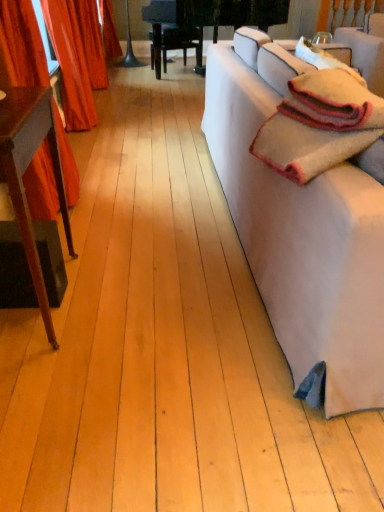
Find the location of a particular element. white fabric couch at right is located at coordinates (301, 233).

This screenshot has width=384, height=512. Identify the location of soft woolen blanket at right. (317, 125).

The image size is (384, 512). I want to click on velvet red curtain at left, marked as the 1th curtain in a front-to-back arrangement, so click(x=22, y=45).

The width and height of the screenshot is (384, 512). What do you see at coordinates (25, 170) in the screenshot? I see `mahogany wood table at left` at bounding box center [25, 170].

Find the location of `velvet red curtain at left, the first curtain when ordered from back to front`. velvet red curtain at left, the first curtain when ordered from back to front is located at coordinates (77, 57).

From a real-world perspective, is soft woolen blanket at right located beneath mahogany wood table at left?

No, from a real-world perspective, soft woolen blanket at right is not beneath mahogany wood table at left.

Is point (351, 122) positioned in front of point (23, 167)?

That is True.

Is soft woolen blanket at right positioned beyond the bounds of mahogany wood table at left?

Absolutely, soft woolen blanket at right is external to mahogany wood table at left.

Is soft woolen blanket at right taller than mahogany wood table at left?

In fact, soft woolen blanket at right may be shorter than mahogany wood table at left.

Based on the photo, which object is thinner, velvet red curtain at left, the first curtain when ordered from back to front, or mahogany wood table at left?

With smaller width is mahogany wood table at left.

Choose the correct answer: Is velvet red curtain at left, marked as the 2th curtain in a front-to-back arrangement, inside mahogany wood table at left or outside it?

velvet red curtain at left, marked as the 2th curtain in a front-to-back arrangement, is spatially situated outside mahogany wood table at left.

Between velvet red curtain at left, marked as the 2th curtain in a front-to-back arrangement, and mahogany wood table at left, which one has less height?

mahogany wood table at left.

Which object is more forward, velvet red curtain at left, marked as the 2th curtain in a front-to-back arrangement, or mahogany wood table at left?

mahogany wood table at left is closer to the camera.

From a real-world perspective, relative to velvet red curtain at left, marked as the 1th curtain in a front-to-back arrangement, is mahogany wood table at left vertically above or below?

In terms of real-world spatial position, mahogany wood table at left is below velvet red curtain at left, marked as the 1th curtain in a front-to-back arrangement.

Is mahogany wood table at left outside of velvet red curtain at left, the second curtain when ordered from back to front?

That's correct, mahogany wood table at left is outside of velvet red curtain at left, the second curtain when ordered from back to front.

Would you say mahogany wood table at left is to the left or to the right of velvet red curtain at left, marked as the 1th curtain in a front-to-back arrangement, in the picture?

In the image, mahogany wood table at left appears on the right side of velvet red curtain at left, marked as the 1th curtain in a front-to-back arrangement.

How many degrees apart are the facing directions of mahogany wood table at left and velvet red curtain at left, marked as the 1th curtain in a front-to-back arrangement?

There is a 0.661-degree angle between the facing directions of mahogany wood table at left and velvet red curtain at left, marked as the 1th curtain in a front-to-back arrangement.

Which point is more distant from viewer, (287, 149) or (236, 129)?

Positioned behind is point (236, 129).

Is white fabric couch at right inside soft woolen blanket at right?

Definitely not — white fabric couch at right is not inside soft woolen blanket at right.

Can you confirm if soft woolen blanket at right is positioned to the right of white fabric couch at right?

No, soft woolen blanket at right is not to the right of white fabric couch at right.

From a real-world perspective, which object stands above the other?

In real-world perspective, soft woolen blanket at right is above.

Who is taller, soft woolen blanket at right or velvet red curtain at left, marked as the 1th curtain in a front-to-back arrangement?

velvet red curtain at left, marked as the 1th curtain in a front-to-back arrangement.

From the image's perspective, would you say soft woolen blanket at right is positioned over velvet red curtain at left, marked as the 1th curtain in a front-to-back arrangement?

Actually, soft woolen blanket at right appears below velvet red curtain at left, marked as the 1th curtain in a front-to-back arrangement, in the image.

From a real-world perspective, between soft woolen blanket at right and velvet red curtain at left, marked as the 1th curtain in a front-to-back arrangement, who is vertically higher?

soft woolen blanket at right.

Considering the positions of objects soft woolen blanket at right and velvet red curtain at left, the second curtain when ordered from back to front, in the image provided, who is more to the right, soft woolen blanket at right or velvet red curtain at left, the second curtain when ordered from back to front,?

soft woolen blanket at right.

Which is correct: white fabric couch at right is inside velvet red curtain at left, the first curtain when ordered from back to front, or outside of it?

white fabric couch at right is outside velvet red curtain at left, the first curtain when ordered from back to front.

From a real-world perspective, which object rests below the other?

From a 3D spatial view, white fabric couch at right is below.

Considering the sizes of white fabric couch at right and velvet red curtain at left, the first curtain when ordered from back to front, in the image, is white fabric couch at right taller or shorter than velvet red curtain at left, the first curtain when ordered from back to front,?

Considering their sizes, white fabric couch at right has less height than velvet red curtain at left, the first curtain when ordered from back to front.

Is white fabric couch at right thinner than velvet red curtain at left, the first curtain when ordered from back to front?

No, white fabric couch at right is not thinner than velvet red curtain at left, the first curtain when ordered from back to front.

Is velvet red curtain at left, the first curtain when ordered from back to front, oriented towards soft woolen blanket at right?

No, velvet red curtain at left, the first curtain when ordered from back to front, is not aimed at soft woolen blanket at right.

Consider the image. From a real-world perspective, does velvet red curtain at left, marked as the 2th curtain in a front-to-back arrangement, stand above soft woolen blanket at right?

No, from a real-world perspective, velvet red curtain at left, marked as the 2th curtain in a front-to-back arrangement, is not on top of soft woolen blanket at right.

Is velvet red curtain at left, marked as the 2th curtain in a front-to-back arrangement, wider or thinner than soft woolen blanket at right?

Clearly, velvet red curtain at left, marked as the 2th curtain in a front-to-back arrangement, has less width compared to soft woolen blanket at right.

You are a GUI agent. You are given a task and a screenshot of the screen. Output one action in this format:
    pyautogui.click(x=<x>, y=<y>)
    Task: Click on the table below the soft woolen blanket at right (from a real-world perspective)
    
    Given the screenshot: What is the action you would take?
    pyautogui.click(x=25, y=170)

You are a GUI agent. You are given a task and a screenshot of the screen. Output one action in this format:
    pyautogui.click(x=<x>, y=<y>)
    Task: Click on the 2nd curtain behind the mahogany wood table at left, starting your count from the anchor
    The width and height of the screenshot is (384, 512).
    Given the screenshot: What is the action you would take?
    pyautogui.click(x=77, y=57)

Estimate the real-world distances between objects in this image. Which object is closer to mahogany wood table at left, velvet red curtain at left, the first curtain when ordered from back to front, or velvet red curtain at left, the second curtain when ordered from back to front?

velvet red curtain at left, the second curtain when ordered from back to front.

Considering their positions, is white fabric couch at right positioned further to soft woolen blanket at right than velvet red curtain at left, the first curtain when ordered from back to front?

velvet red curtain at left, the first curtain when ordered from back to front.

Considering their positions, is mahogany wood table at left positioned closer to white fabric couch at right than soft woolen blanket at right?

soft woolen blanket at right lies closer to white fabric couch at right than the other object.

Which object lies nearer to the anchor point soft woolen blanket at right, mahogany wood table at left or velvet red curtain at left, marked as the 1th curtain in a front-to-back arrangement?

mahogany wood table at left is positioned closer to the anchor soft woolen blanket at right.

Estimate the real-world distances between objects in this image. Which object is closer to velvet red curtain at left, the second curtain when ordered from back to front, soft woolen blanket at right or velvet red curtain at left, marked as the 2th curtain in a front-to-back arrangement?

soft woolen blanket at right is positioned closer to the anchor velvet red curtain at left, the second curtain when ordered from back to front.

Considering their positions, is soft woolen blanket at right positioned further to velvet red curtain at left, the first curtain when ordered from back to front, than velvet red curtain at left, marked as the 1th curtain in a front-to-back arrangement?

soft woolen blanket at right lies further to velvet red curtain at left, the first curtain when ordered from back to front, than the other object.

When comparing their distances from velvet red curtain at left, marked as the 2th curtain in a front-to-back arrangement, does velvet red curtain at left, marked as the 1th curtain in a front-to-back arrangement, or mahogany wood table at left seem closer?

Among the two, velvet red curtain at left, marked as the 1th curtain in a front-to-back arrangement, is located nearer to velvet red curtain at left, marked as the 2th curtain in a front-to-back arrangement.

Looking at the image, which one is located closer to velvet red curtain at left, the second curtain when ordered from back to front, mahogany wood table at left or soft woolen blanket at right?

mahogany wood table at left is closer to velvet red curtain at left, the second curtain when ordered from back to front.

I want to click on blanket between white fabric couch at right and velvet red curtain at left, marked as the 2th curtain in a front-to-back arrangement, in the front-back direction, so pyautogui.click(x=317, y=125).

Locate an element on the screen. curtain located between white fabric couch at right and velvet red curtain at left, marked as the 2th curtain in a front-to-back arrangement, in the depth direction is located at coordinates (22, 45).

Identify the location of table located between velvet red curtain at left, marked as the 1th curtain in a front-to-back arrangement, and soft woolen blanket at right in the left-right direction. This screenshot has width=384, height=512. (25, 170).

Find the location of a particular element. Image resolution: width=384 pixels, height=512 pixels. curtain located between soft woolen blanket at right and velvet red curtain at left, the first curtain when ordered from back to front, in the depth direction is located at coordinates (22, 45).